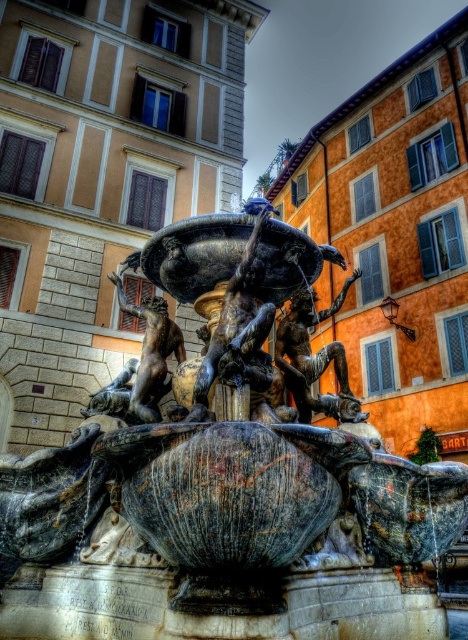
Question: Observing the image, what is the correct spatial positioning of marble statue at center in reference to bronze statue at center?

Choices:
 (A) above
 (B) below

Answer: (B)

Question: Does marble statue at center lie in front of bronze statue at center?

Choices:
 (A) no
 (B) yes

Answer: (B)

Question: Among these objects, which one is nearest to the camera?

Choices:
 (A) polished bronze statue at center
 (B) bronze statue at center

Answer: (A)

Question: In this image, where is polished bronze statue at center located relative to bronze statue at center?

Choices:
 (A) below
 (B) above

Answer: (A)

Question: Which point is farther from the camera taking this photo?

Choices:
 (A) (334, 342)
 (B) (216, 637)

Answer: (A)

Question: Among these points, which one is farthest from the camera?

Choices:
 (A) pos(228,540)
 (B) pos(129,403)
 (C) pos(331,342)

Answer: (C)